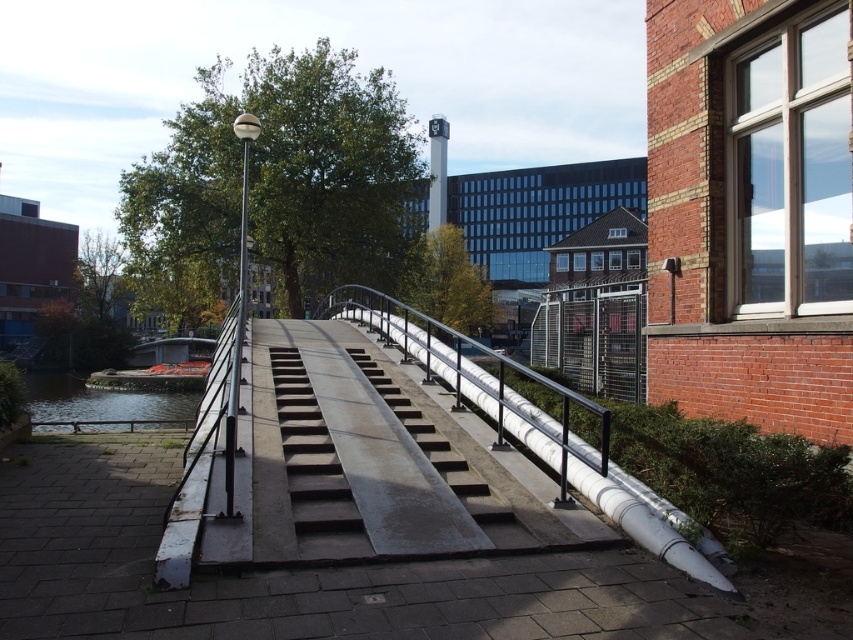
Who is more forward, [223,412] or [305,493]?

Point [305,493] is in front.

You are a GUI agent. You are given a task and a screenshot of the screen. Output one action in this format:
    pyautogui.click(x=<x>, y=<y>)
    Task: Click on the metallic gray bridge at center
    The image size is (853, 640).
    Given the screenshot: What is the action you would take?
    pyautogui.click(x=386, y=461)

Who is more forward, (329, 346) or (303, 477)?

Point (303, 477) is more forward.

The image size is (853, 640). Identify the location of metallic gray bridge at center. (386, 461).

Does concrete stairs at center come in front of greenish water at lower left?

Yes, it is.

Which of these two, concrete stairs at center or greenish water at lower left, stands taller?

greenish water at lower left

What do you see at coordinates (312, 468) in the screenshot?
I see `concrete stairs at center` at bounding box center [312, 468].

Image resolution: width=853 pixels, height=640 pixels. I want to click on concrete stairs at center, so [312, 468].

Between metallic gray bridge at center and greenish water at lower left, which one has more height?

greenish water at lower left

Is point (492, 500) positioned in front of point (71, 380)?

That is True.

Looking at this image, who is more distant from viewer, [329,369] or [109,376]?

Point [109,376]

What are the coordinates of `metallic gray bridge at center` in the screenshot? It's located at (386, 461).